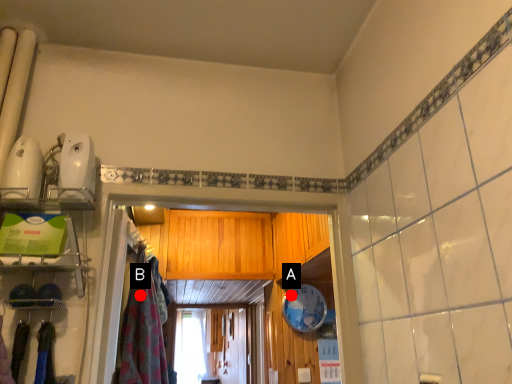
Question: Two points are circled on the image, labeled by A and B beside each circle. Which of the following is the farthest from the observer?

Choices:
 (A) A is further
 (B) B is further

Answer: (A)